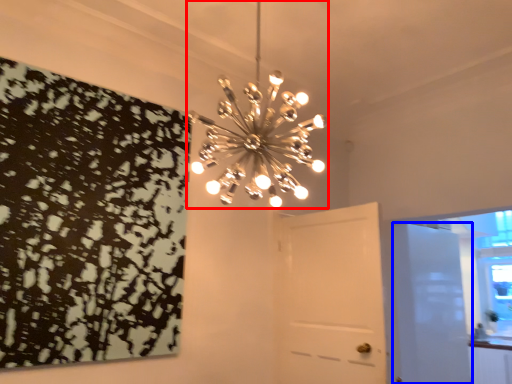
Question: Which object is closer to the camera taking this photo, lamp (highlighted by a red box) or door (highlighted by a blue box)?

Choices:
 (A) lamp
 (B) door

Answer: (A)